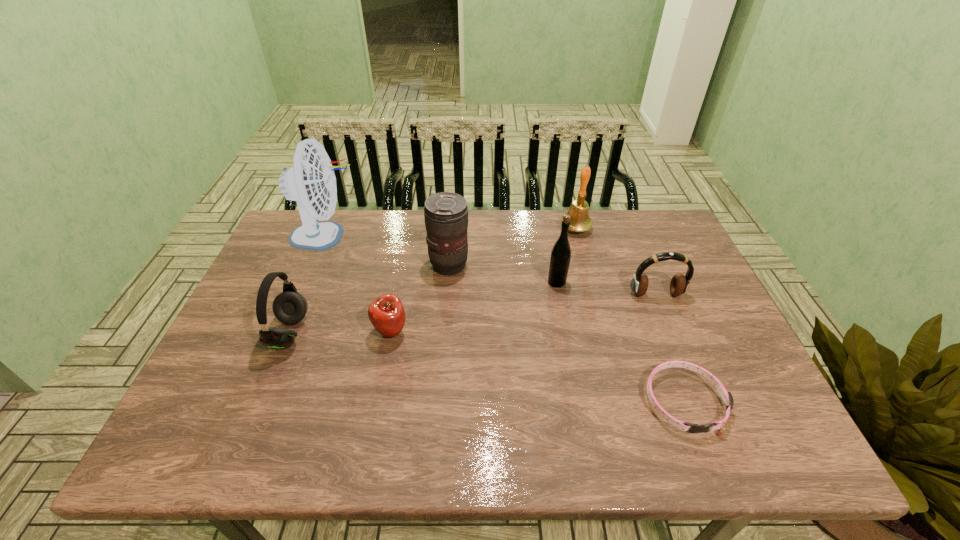
Image resolution: width=960 pixels, height=540 pixels. What are the coordinates of `bell that is at the far edge` in the screenshot? It's located at (580, 221).

This screenshot has width=960, height=540. In order to click on telephoto lens that is at the far edge in this screenshot , I will do `click(446, 214)`.

Identify the location of object that is at the near edge. (727, 397).

Locate an element on the screen. fan positioned at the left edge is located at coordinates (311, 181).

You are a GUI agent. You are given a task and a screenshot of the screen. Output one action in this format:
    pyautogui.click(x=<x>, y=<y>)
    Task: Click on the headset that is at the left edge
    The image size is (960, 540).
    Given the screenshot: What is the action you would take?
    pyautogui.click(x=289, y=307)

Where is `headset situated at the right edge`? The width and height of the screenshot is (960, 540). headset situated at the right edge is located at coordinates (679, 284).

Identify the location of dog collar situated at the right edge. The height and width of the screenshot is (540, 960). (727, 397).

The width and height of the screenshot is (960, 540). Identify the location of object present at the far left corner. (311, 181).

Locate an element on the screen. The width and height of the screenshot is (960, 540). object present at the near right corner is located at coordinates (727, 397).

The width and height of the screenshot is (960, 540). In the image, there is a desktop. What are the coordinates of `free space at the far edge` in the screenshot? It's located at (335, 248).